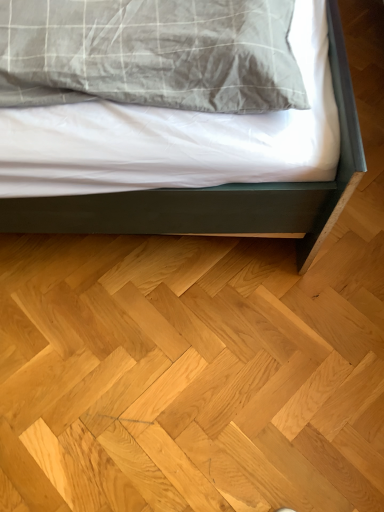
Question: Considering the positions of point (52, 209) and point (112, 354), is point (52, 209) closer or farther from the camera than point (112, 354)?

Choices:
 (A) farther
 (B) closer

Answer: (B)

Question: In terms of height, does matte gray bed at center look taller or shorter compared to natural wood floor at lower center?

Choices:
 (A) tall
 (B) short

Answer: (A)

Question: Is matte gray bed at center situated inside natural wood floor at lower center or outside?

Choices:
 (A) outside
 (B) inside

Answer: (A)

Question: From a real-world perspective, is natural wood floor at lower center physically located above or below matte gray bed at center?

Choices:
 (A) above
 (B) below

Answer: (B)

Question: Considering the positions of natural wood floor at lower center and matte gray bed at center in the image, is natural wood floor at lower center taller or shorter than matte gray bed at center?

Choices:
 (A) tall
 (B) short

Answer: (B)

Question: In terms of size, does natural wood floor at lower center appear bigger or smaller than matte gray bed at center?

Choices:
 (A) big
 (B) small

Answer: (B)

Question: Looking at their shapes, would you say natural wood floor at lower center is wider or thinner than matte gray bed at center?

Choices:
 (A) thin
 (B) wide

Answer: (B)